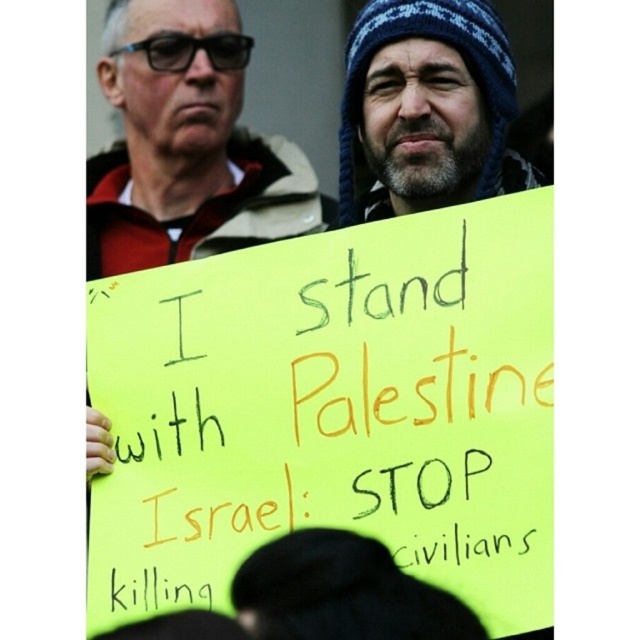
Looking at this image, you are a photographer trying to capture a clear photo of the blue knitted hat at upper right. However, the matte black jacket at upper left is blocking your view. Can you move around to the left side to get a better shot?

The blue knitted hat at upper right is behind the matte black jacket at upper left, so moving to the left side might allow you to see around the matte black jacket at upper left and get a clearer view of the blue knitted hat at upper right.

Looking at the protest scene, where is the matte black jacket at upper left in relation to the blue knitted hat at upper right?

The matte black jacket at upper left is to the left of the blue knitted hat at upper right.